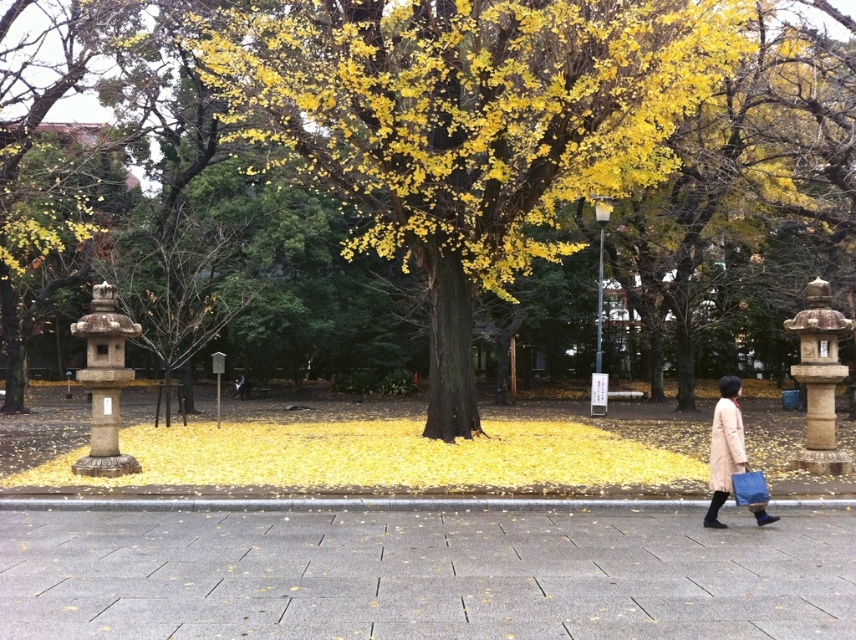
Question: Does yellow leafy tree at center have a lesser width compared to gray concrete pavement at center?

Choices:
 (A) yes
 (B) no

Answer: (B)

Question: Is gray concrete pavement at center bigger than light beige wool coat at lower right?

Choices:
 (A) yes
 (B) no

Answer: (B)

Question: Which point appears closest to the camera in this image?

Choices:
 (A) (45, 576)
 (B) (723, 490)

Answer: (A)

Question: Which point appears closest to the camera in this image?

Choices:
 (A) (566, 524)
 (B) (693, 19)

Answer: (A)

Question: Does beige wool coat at lower right appear under light beige wool coat at lower right?

Choices:
 (A) yes
 (B) no

Answer: (B)

Question: Considering the real-world distances, which object is farthest from the beige wool coat at lower right?

Choices:
 (A) yellow leafy tree at center
 (B) light beige wool coat at lower right
 (C) gray concrete pavement at center

Answer: (A)